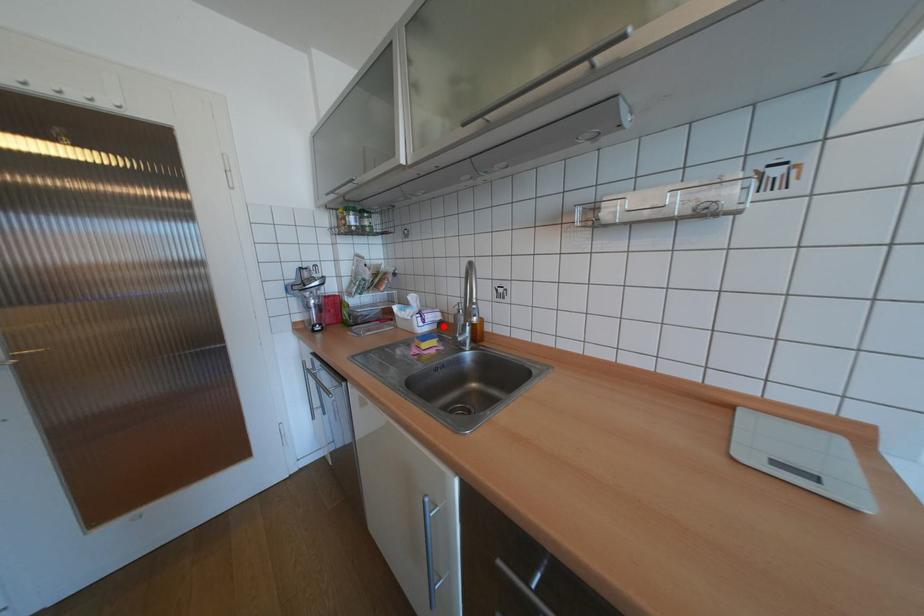
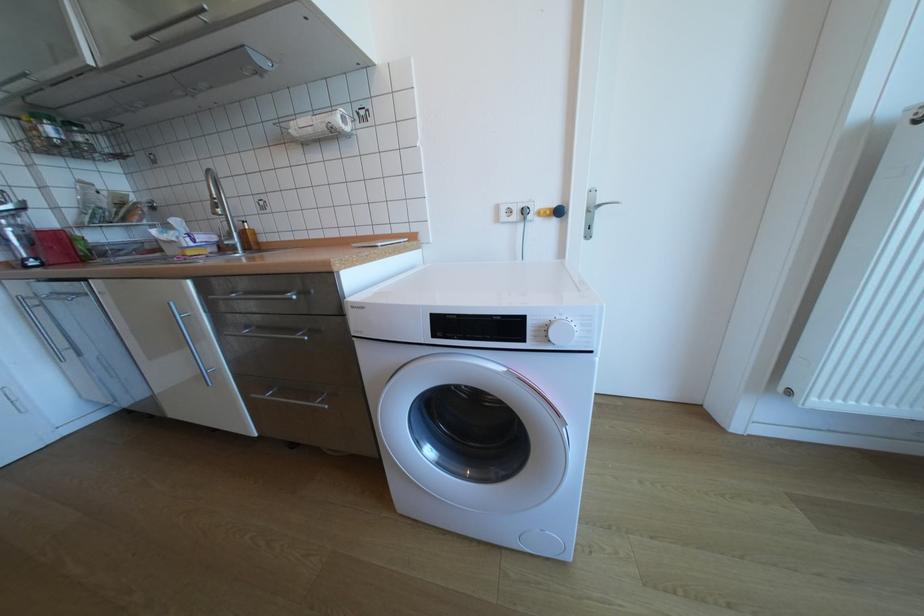
In the second image, find the point that corresponds to the highlighted location in the first image.

(224, 249)